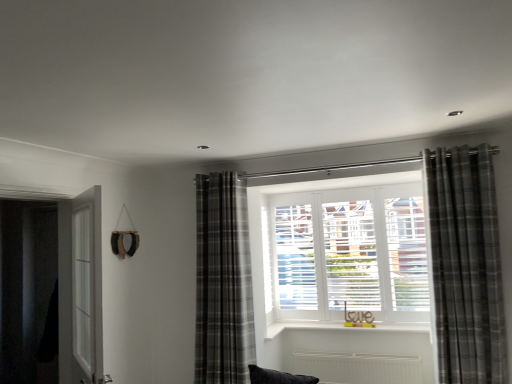
Question: Is black matte door at left surrounded by gray plaid curtain at right, which appears as the 1th curtain when viewed from the front?

Choices:
 (A) no
 (B) yes

Answer: (A)

Question: Does gray plaid curtain at right, the second curtain from the back, have a smaller size compared to black matte door at left?

Choices:
 (A) yes
 (B) no

Answer: (A)

Question: Is gray plaid curtain at right, which appears as the 1th curtain when viewed from the front, thinner than black matte door at left?

Choices:
 (A) yes
 (B) no

Answer: (B)

Question: Can you confirm if gray plaid curtain at right, which appears as the 2th curtain when viewed from the left, is taller than black matte door at left?

Choices:
 (A) no
 (B) yes

Answer: (B)

Question: Is gray plaid curtain at right, which ranks as the 1th curtain in right-to-left order, aimed at black matte door at left?

Choices:
 (A) yes
 (B) no

Answer: (B)

Question: Is gray plaid curtain at center, the 2th curtain in the front-to-back sequence, bigger or smaller than gray plaid curtain at right, the second curtain from the back?

Choices:
 (A) big
 (B) small

Answer: (A)

Question: Considering the positions of point (226, 208) and point (428, 157), is point (226, 208) closer or farther from the camera than point (428, 157)?

Choices:
 (A) farther
 (B) closer

Answer: (A)

Question: Considering the positions of gray plaid curtain at center, positioned as the second curtain in right-to-left order, and gray plaid curtain at right, which ranks as the 1th curtain in right-to-left order, in the image, is gray plaid curtain at center, positioned as the second curtain in right-to-left order, taller or shorter than gray plaid curtain at right, which ranks as the 1th curtain in right-to-left order,?

Choices:
 (A) short
 (B) tall

Answer: (B)

Question: Considering the positions of gray plaid curtain at center, the 2th curtain in the front-to-back sequence, and gray plaid curtain at right, which ranks as the 1th curtain in right-to-left order, in the image, is gray plaid curtain at center, the 2th curtain in the front-to-back sequence, wider or thinner than gray plaid curtain at right, which ranks as the 1th curtain in right-to-left order,?

Choices:
 (A) thin
 (B) wide

Answer: (B)

Question: From a real-world perspective, is gray plaid curtain at center, which ranks as the 1th curtain in back-to-front order, physically located above or below clear glass screen door at left?

Choices:
 (A) above
 (B) below

Answer: (B)

Question: Considering the positions of gray plaid curtain at center, placed as the 1th curtain when sorted from left to right, and clear glass screen door at left in the image, is gray plaid curtain at center, placed as the 1th curtain when sorted from left to right, bigger or smaller than clear glass screen door at left?

Choices:
 (A) small
 (B) big

Answer: (B)

Question: Does point (249, 344) appear closer or farther from the camera than point (86, 225)?

Choices:
 (A) farther
 (B) closer

Answer: (A)

Question: Is gray plaid curtain at center, the 2th curtain in the front-to-back sequence, taller or shorter than clear glass screen door at left?

Choices:
 (A) short
 (B) tall

Answer: (B)

Question: From a real-world perspective, is clear glass screen door at left physically located above or below gray plaid curtain at right, which appears as the 1th curtain when viewed from the front?

Choices:
 (A) above
 (B) below

Answer: (B)

Question: Is point (98, 223) positioned closer to the camera than point (482, 322)?

Choices:
 (A) closer
 (B) farther

Answer: (A)